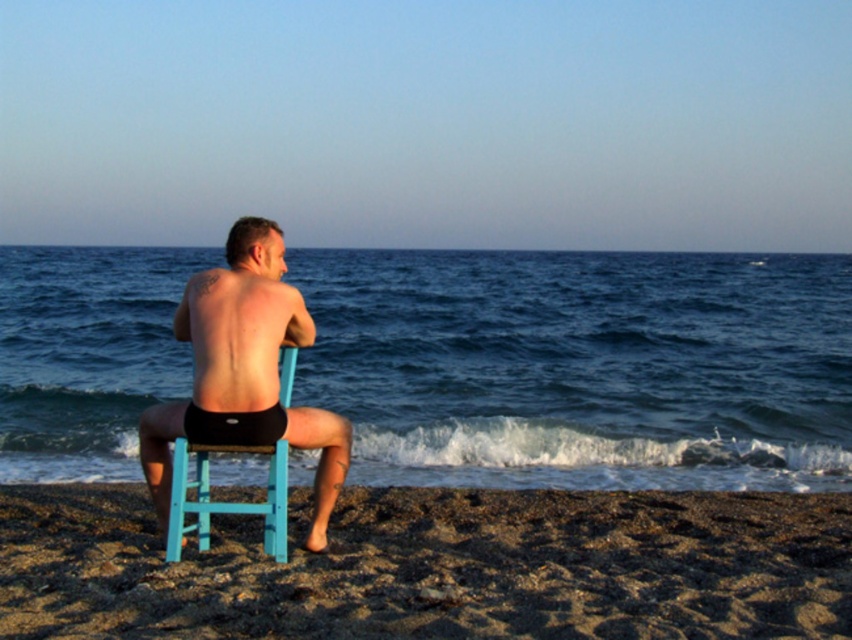
Does sandy brown at lower center have a smaller size compared to black matte shorts at center?

Indeed, sandy brown at lower center has a smaller size compared to black matte shorts at center.

Can you confirm if sandy brown at lower center is bigger than black matte shorts at center?

No, sandy brown at lower center is not bigger than black matte shorts at center.

Who is more forward, (574, 556) or (180, 339)?

Point (180, 339) is in front.

You are a GUI agent. You are given a task and a screenshot of the screen. Output one action in this format:
    pyautogui.click(x=<x>, y=<y>)
    Task: Click on the sandy brown at lower center
    The width and height of the screenshot is (852, 640).
    Given the screenshot: What is the action you would take?
    pyautogui.click(x=435, y=566)

Which is behind, point (45, 308) or point (194, 524)?

The point (45, 308) is behind.

I want to click on blue water at center, so click(583, 365).

Who is more forward, (21, 333) or (173, 536)?

Point (173, 536)

Find the location of a particular element. This screenshot has height=640, width=852. blue water at center is located at coordinates (583, 365).

In the scene shown: Does sandy brown at lower center come behind light blue plastic chair at center?

Yes, it is.

Measure the distance between sandy brown at lower center and camera.

A distance of 6.33 meters exists between sandy brown at lower center and camera.

The width and height of the screenshot is (852, 640). I want to click on sandy brown at lower center, so click(435, 566).